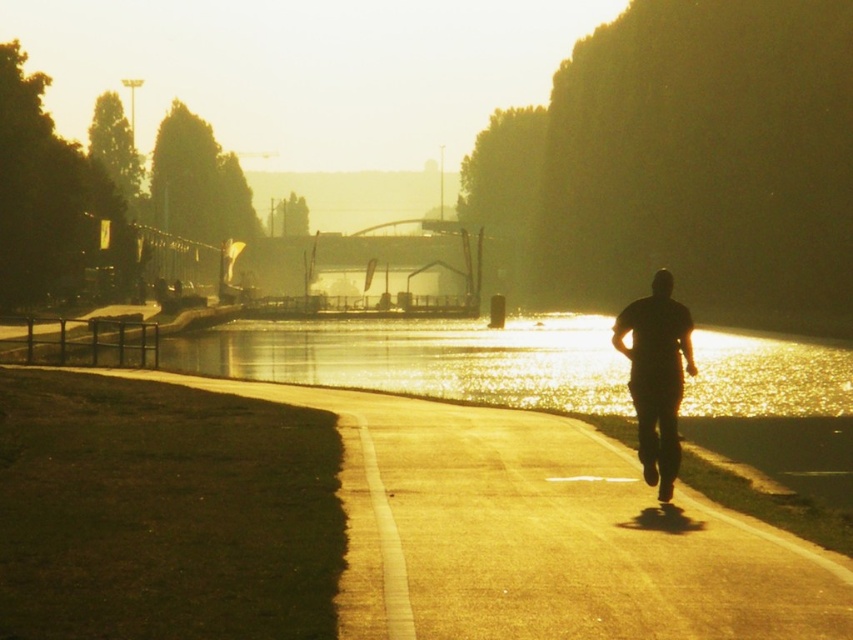
Can you confirm if smooth asphalt path at center is positioned above black matte man at center?

Incorrect, smooth asphalt path at center is not positioned above black matte man at center.

Is smooth asphalt path at center positioned behind black matte man at center?

No, smooth asphalt path at center is closer to the viewer.

Where is `smooth asphalt path at center`? This screenshot has height=640, width=853. smooth asphalt path at center is located at coordinates (538, 532).